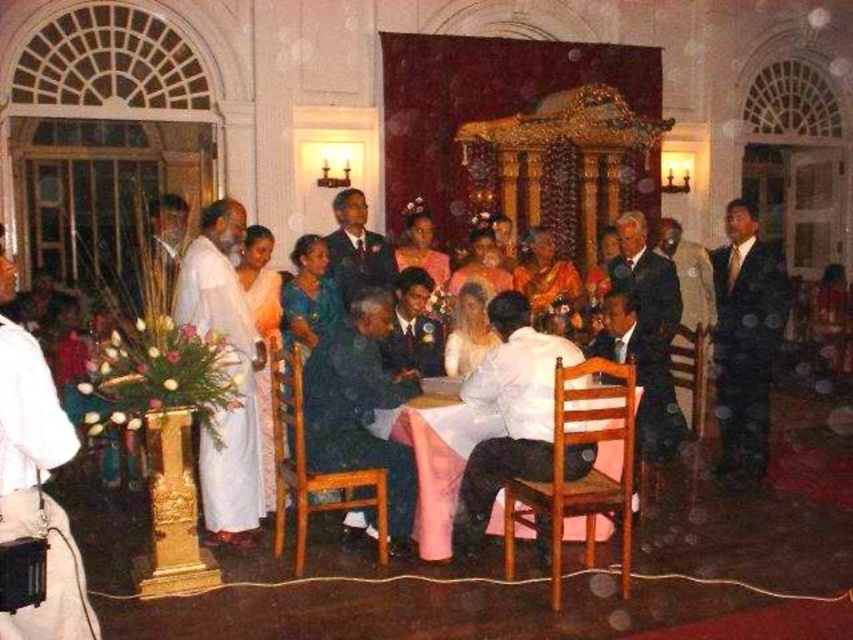
Does white satin dress at center appear on the right side of white cloth-covered table at center?

Yes, white satin dress at center is to the right of white cloth-covered table at center.

Which of these two, white satin dress at center or white cloth-covered table at center, stands taller?

white satin dress at center is taller.

This screenshot has height=640, width=853. What do you see at coordinates (509, 412) in the screenshot? I see `white satin dress at center` at bounding box center [509, 412].

Find the location of a particular element. The height and width of the screenshot is (640, 853). white satin dress at center is located at coordinates (509, 412).